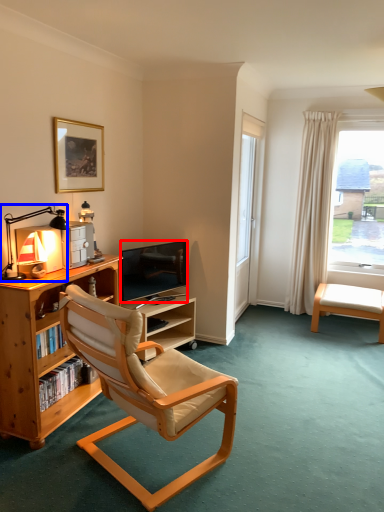
Question: Among these objects, which one is nearest to the camera, television (highlighted by a red box) or lamp (highlighted by a blue box)?

Choices:
 (A) television
 (B) lamp

Answer: (B)